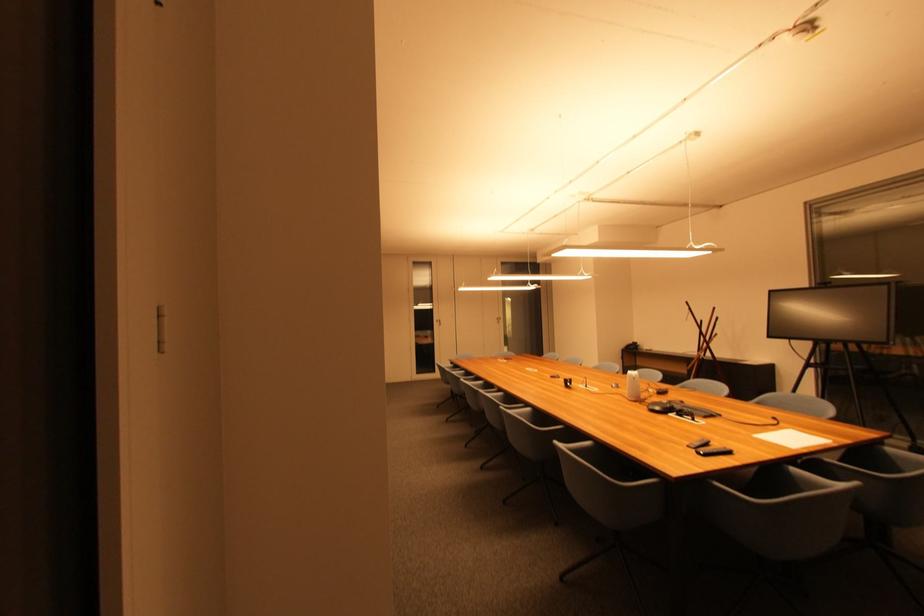
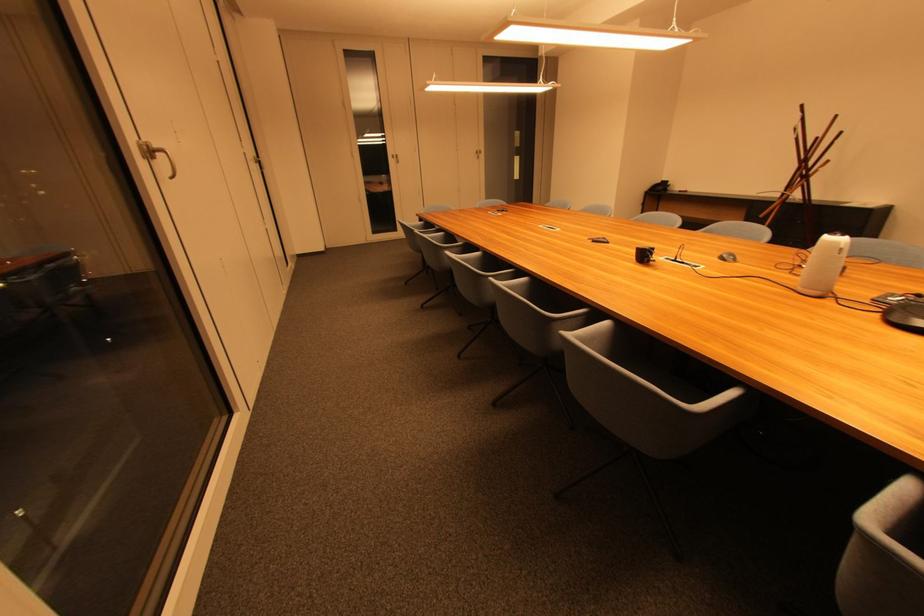
Find the pixel in the second image that matches [556,378] in the first image.

(596, 240)